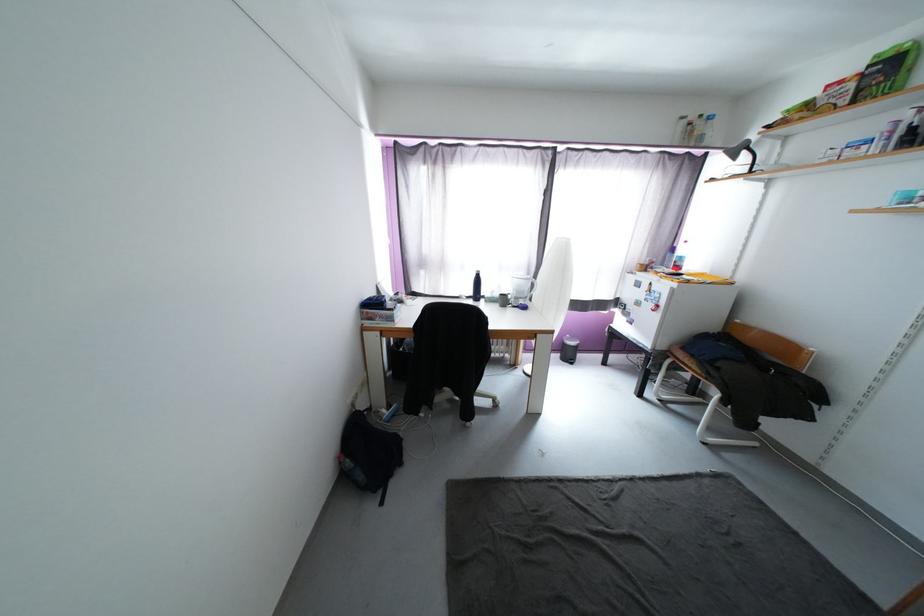
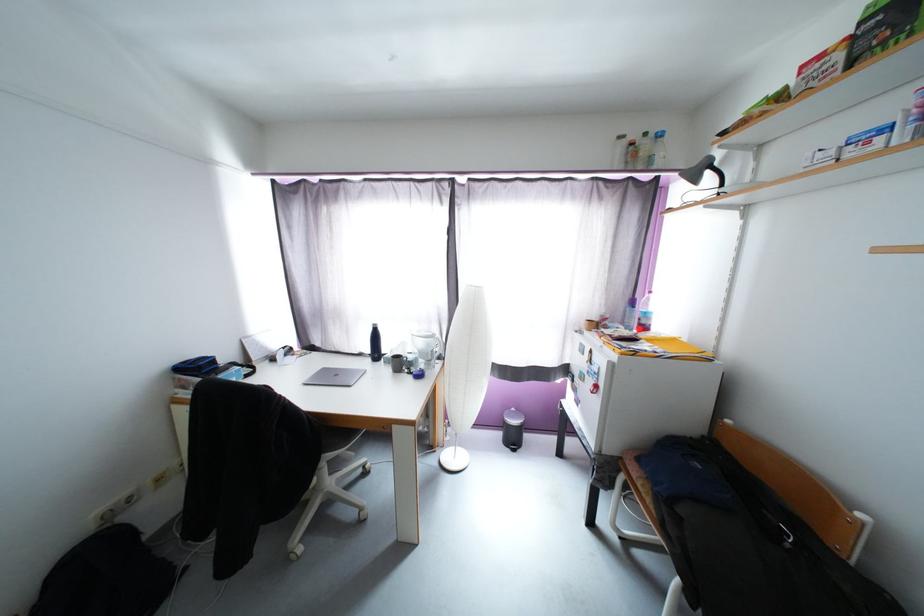
What movement of the cameraman would produce the second image?

The cameraman moved toward right, forward.